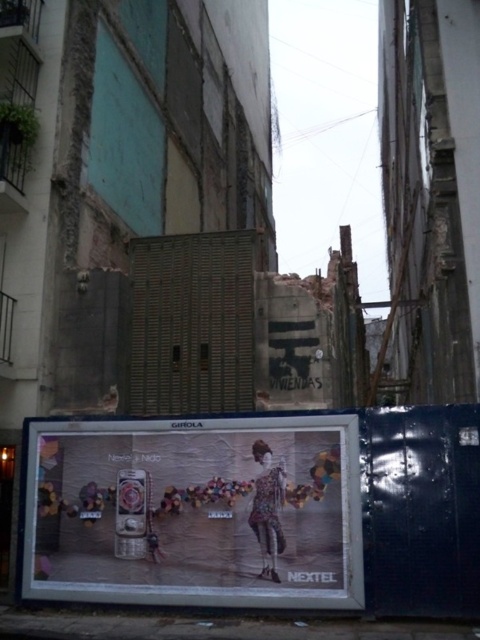
What are the coordinates of `matte silver phone at center` in the screenshot? It's located at 194,512.

Find the location of a particular element. The height and width of the screenshot is (640, 480). matte silver phone at center is located at coordinates (194, 512).